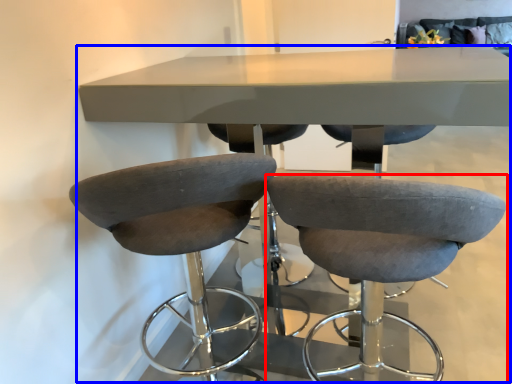
Question: Which object appears farthest to the camera in this image, chair (highlighted by a red box) or table (highlighted by a blue box)?

Choices:
 (A) chair
 (B) table

Answer: (B)